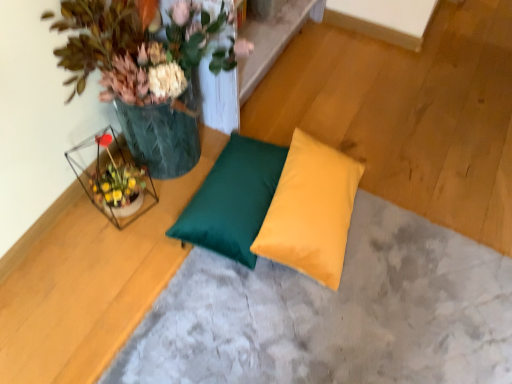
Question: Should I look upward or downward to see yellow satin pillow at center, marked as the second pillow in a left-to-right arrangement?

Choices:
 (A) up
 (B) down

Answer: (B)

Question: Considering the relative positions of green leafy plant at upper left and matte green pillow at center in the image provided, is green leafy plant at upper left to the left of matte green pillow at center from the viewer's perspective?

Choices:
 (A) no
 (B) yes

Answer: (B)

Question: Is green leafy plant at upper left beside matte green pillow at center?

Choices:
 (A) yes
 (B) no

Answer: (B)

Question: From a real-world perspective, does green leafy plant at upper left stand above matte green pillow at center?

Choices:
 (A) yes
 (B) no

Answer: (A)

Question: Does green leafy plant at upper left have a larger size compared to matte green pillow at center?

Choices:
 (A) no
 (B) yes

Answer: (B)

Question: Are green leafy plant at upper left and matte green pillow at center far apart?

Choices:
 (A) no
 (B) yes

Answer: (A)

Question: From a real-world perspective, is green leafy plant at upper left physically below matte green pillow at center?

Choices:
 (A) yes
 (B) no

Answer: (B)

Question: Is matte green pillow at center next to satin green pillow at center, the 2th pillow viewed from the right?

Choices:
 (A) yes
 (B) no

Answer: (B)

Question: Is matte green pillow at center oriented away from satin green pillow at center, the 2th pillow viewed from the right?

Choices:
 (A) no
 (B) yes

Answer: (B)

Question: From a real-world perspective, does matte green pillow at center sit lower than satin green pillow at center, which is the 1th pillow in left-to-right order?

Choices:
 (A) no
 (B) yes

Answer: (B)

Question: From a real-world perspective, is matte green pillow at center positioned over satin green pillow at center, which is the 1th pillow in left-to-right order, based on gravity?

Choices:
 (A) no
 (B) yes

Answer: (A)

Question: Considering the relative positions of matte green pillow at center and satin green pillow at center, the 2th pillow viewed from the right, in the image provided, is matte green pillow at center behind satin green pillow at center, the 2th pillow viewed from the right,?

Choices:
 (A) yes
 (B) no

Answer: (B)

Question: Can you confirm if matte green pillow at center is thinner than satin green pillow at center, the 2th pillow viewed from the right?

Choices:
 (A) no
 (B) yes

Answer: (A)

Question: From a real-world perspective, is green leafy plant at upper left below yellow satin pillow at center, the first pillow viewed from the right?

Choices:
 (A) yes
 (B) no

Answer: (B)